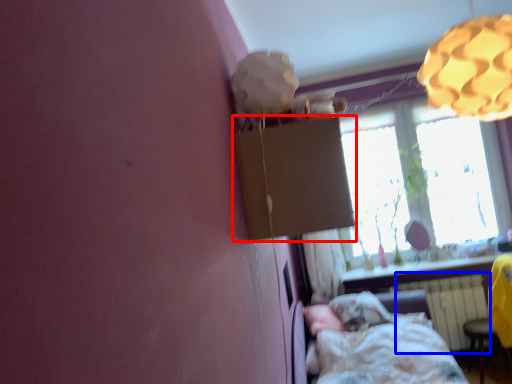
Question: Which object appears farthest to the camera in this image, cardboard box (highlighted by a red box) or radiator (highlighted by a blue box)?

Choices:
 (A) cardboard box
 (B) radiator

Answer: (B)